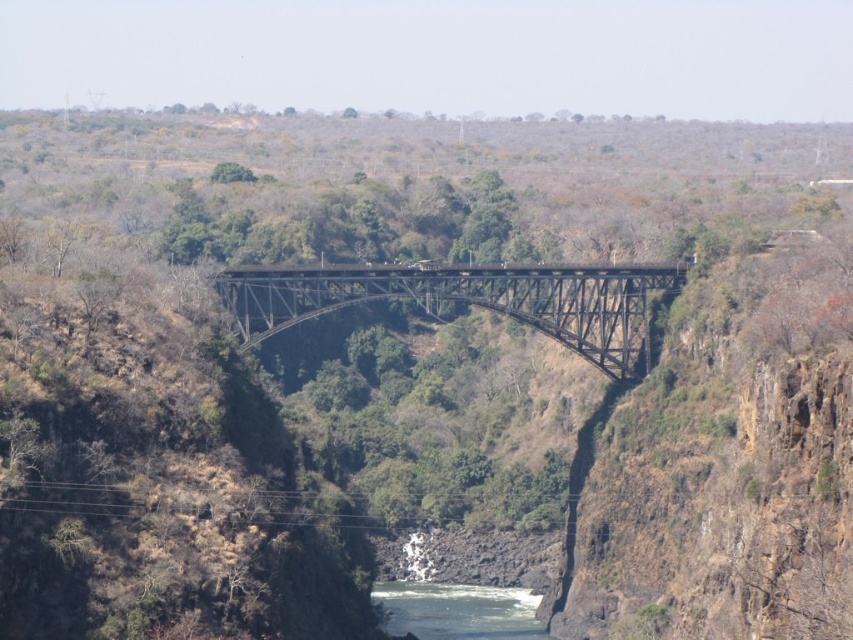
Question: Can you confirm if black metal bridge at center is bigger than greenish-blue water at center?

Choices:
 (A) yes
 (B) no

Answer: (A)

Question: Can you confirm if black metal bridge at center is positioned to the left of greenish-blue water at center?

Choices:
 (A) yes
 (B) no

Answer: (A)

Question: Which point appears closest to the camera in this image?

Choices:
 (A) (492, 589)
 (B) (639, 273)

Answer: (B)

Question: Which point appears closest to the camera in this image?

Choices:
 (A) (590, 308)
 (B) (444, 632)

Answer: (B)

Question: Can you confirm if black metal bridge at center is positioned below greenish-blue water at center?

Choices:
 (A) no
 (B) yes

Answer: (A)